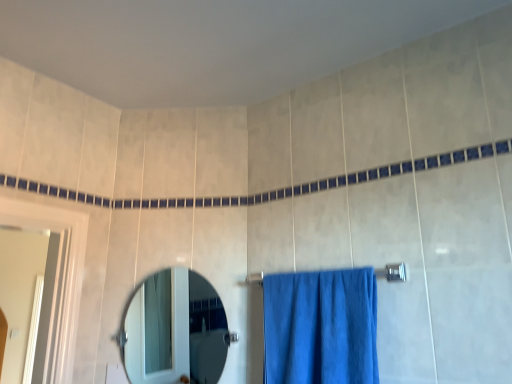
Question: Considering the relative sizes of clear glass mirror at center and blue fabric towel at center in the image provided, is clear glass mirror at center taller than blue fabric towel at center?

Choices:
 (A) yes
 (B) no

Answer: (A)

Question: From the image's perspective, is clear glass mirror at center above blue fabric towel at center?

Choices:
 (A) yes
 (B) no

Answer: (B)

Question: Does clear glass mirror at center appear on the right side of blue fabric towel at center?

Choices:
 (A) no
 (B) yes

Answer: (A)

Question: From a real-world perspective, is clear glass mirror at center over blue fabric towel at center?

Choices:
 (A) yes
 (B) no

Answer: (A)

Question: Is clear glass mirror at center to the left of blue fabric towel at center from the viewer's perspective?

Choices:
 (A) no
 (B) yes

Answer: (B)

Question: Is clear glass mirror at center oriented away from blue fabric towel at center?

Choices:
 (A) no
 (B) yes

Answer: (A)

Question: From the image's perspective, is blue fabric towel at center below silver metallic towel bar at center?

Choices:
 (A) no
 (B) yes

Answer: (B)

Question: Does blue fabric towel at center have a greater height compared to silver metallic towel bar at center?

Choices:
 (A) yes
 (B) no

Answer: (A)

Question: Does blue fabric towel at center appear on the left side of silver metallic towel bar at center?

Choices:
 (A) yes
 (B) no

Answer: (A)

Question: Is blue fabric towel at center thinner than silver metallic towel bar at center?

Choices:
 (A) yes
 (B) no

Answer: (B)

Question: Is blue fabric towel at center facing towards silver metallic towel bar at center?

Choices:
 (A) yes
 (B) no

Answer: (B)

Question: Is there a large distance between blue fabric towel at center and silver metallic towel bar at center?

Choices:
 (A) yes
 (B) no

Answer: (B)

Question: Is silver metallic towel bar at center to the right of blue fabric towel at center from the viewer's perspective?

Choices:
 (A) yes
 (B) no

Answer: (A)